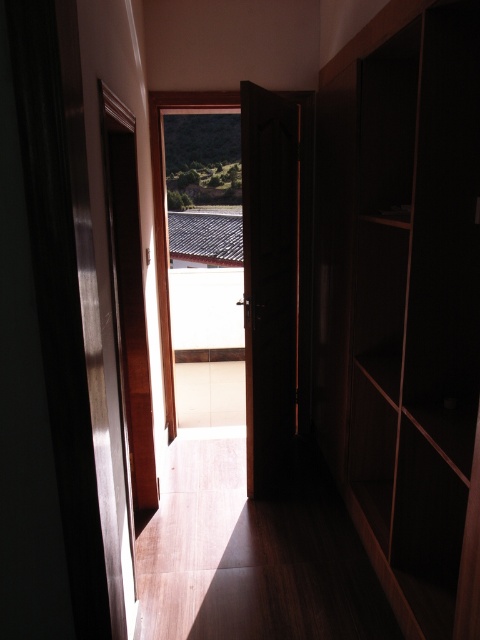
Consider the image. Can you confirm if dark wood cabinet at right is wider than dark wood door at center?

Yes, dark wood cabinet at right is wider than dark wood door at center.

Does point (437, 161) come behind point (257, 336)?

That is False.

The width and height of the screenshot is (480, 640). Identify the location of dark wood cabinet at right. (405, 304).